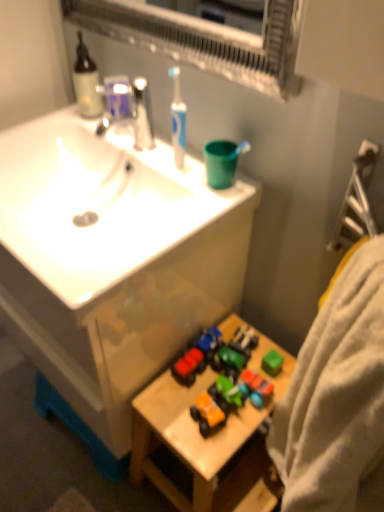
Question: Is white glossy sink at upper left outside of translucent glass soap dispenser at upper left?

Choices:
 (A) no
 (B) yes

Answer: (B)

Question: From the image's perspective, does white glossy sink at upper left appear higher than translucent glass soap dispenser at upper left?

Choices:
 (A) yes
 (B) no

Answer: (B)

Question: Would you say white glossy sink at upper left is a long distance from translucent glass soap dispenser at upper left?

Choices:
 (A) yes
 (B) no

Answer: (B)

Question: Can you confirm if white glossy sink at upper left is smaller than translucent glass soap dispenser at upper left?

Choices:
 (A) yes
 (B) no

Answer: (B)

Question: From a real-world perspective, does white glossy sink at upper left stand above translucent glass soap dispenser at upper left?

Choices:
 (A) no
 (B) yes

Answer: (A)

Question: Is translucent glass soap dispenser at upper left inside white glossy sink at upper left?

Choices:
 (A) no
 (B) yes

Answer: (A)

Question: Is white glossy sink at upper left looking in the opposite direction of matte silver faucet at upper center?

Choices:
 (A) yes
 (B) no

Answer: (B)

Question: Is white glossy sink at upper left positioned far away from matte silver faucet at upper center?

Choices:
 (A) yes
 (B) no

Answer: (B)

Question: From the image's perspective, is white glossy sink at upper left over matte silver faucet at upper center?

Choices:
 (A) yes
 (B) no

Answer: (B)

Question: Is white glossy sink at upper left at the right side of matte silver faucet at upper center?

Choices:
 (A) yes
 (B) no

Answer: (B)

Question: From the image's perspective, is white glossy sink at upper left below matte silver faucet at upper center?

Choices:
 (A) no
 (B) yes

Answer: (B)

Question: Can you confirm if white glossy sink at upper left is thinner than matte silver faucet at upper center?

Choices:
 (A) yes
 (B) no

Answer: (B)

Question: Is translucent glass soap dispenser at upper left thinner than wooden toy at lower right?

Choices:
 (A) no
 (B) yes

Answer: (B)